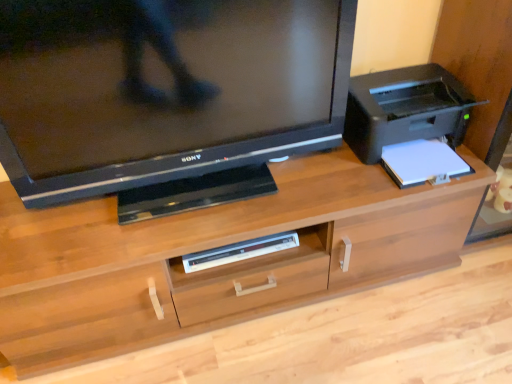
Where is `matte black television at upper left`? matte black television at upper left is located at coordinates (164, 89).

Describe the element at coordinates (164, 89) in the screenshot. This screenshot has width=512, height=384. I see `matte black television at upper left` at that location.

At what (x,y) coordinates should I click in order to perform the action: click on wooden desk at center. Please return your answer as a coordinate pair (x, y). The image size is (512, 384). Looking at the image, I should click on (217, 267).

Would you consider wooden desk at center to be distant from matte black television at upper left?

wooden desk at center is near matte black television at upper left, not far away.

From the image's perspective, which object appears higher, wooden desk at center or matte black television at upper left?

matte black television at upper left.

You are a GUI agent. You are given a task and a screenshot of the screen. Output one action in this format:
    pyautogui.click(x=<x>, y=<y>)
    Task: Click on the desk below the matte black television at upper left (from the image's perspective)
    
    Given the screenshot: What is the action you would take?
    pyautogui.click(x=217, y=267)

Is matte black television at upper left touching white plastic dvd player at center?

matte black television at upper left is not next to white plastic dvd player at center, and they're not touching.

Is matte black television at upper left outside of white plastic dvd player at center?

matte black television at upper left lies outside white plastic dvd player at center's area.

From a real-world perspective, which is physically above, matte black television at upper left or white plastic dvd player at center?

From a 3D spatial view, matte black television at upper left is above.

You are a GUI agent. You are given a task and a screenshot of the screen. Output one action in this format:
    pyautogui.click(x=<x>, y=<y>)
    Task: Click on the equipment lying behind the matte black television at upper left
    This screenshot has width=512, height=384.
    Given the screenshot: What is the action you would take?
    pyautogui.click(x=239, y=251)

Between wooden desk at center and white plastic dvd player at center, which one has larger width?

With larger width is wooden desk at center.

What's the angular difference between wooden desk at center and white plastic dvd player at center's facing directions?

The facing directions of wooden desk at center and white plastic dvd player at center are 3.06 degrees apart.

Is point (383, 217) more distant than point (275, 236)?

No, it is in front of (275, 236).

Based on the photo, is wooden desk at center inside the boundaries of white plastic dvd player at center, or outside?

wooden desk at center is located beyond the bounds of white plastic dvd player at center.

From a real-world perspective, is matte black television at upper left physically located above or below wooden desk at center?

In terms of real-world spatial position, matte black television at upper left is above wooden desk at center.

Is matte black television at upper left positioned far away from wooden desk at center?

matte black television at upper left is near wooden desk at center, not far away.

Is wooden desk at center at the back of matte black television at upper left?

No, wooden desk at center is not at the back of matte black television at upper left.

Measure the distance from matte black television at upper left to wooden desk at center.

matte black television at upper left and wooden desk at center are 11.96 inches apart.

Is white plastic dvd player at center positioned with its back to matte black television at upper left?

white plastic dvd player at center is not turned away from matte black television at upper left.

Considering the relative sizes of white plastic dvd player at center and matte black television at upper left in the image provided, is white plastic dvd player at center taller than matte black television at upper left?

Incorrect, the height of white plastic dvd player at center is not larger of that of matte black television at upper left.

Can you confirm if white plastic dvd player at center is bigger than matte black television at upper left?

No, white plastic dvd player at center is not bigger than matte black television at upper left.

Is white plastic dvd player at center spatially inside matte black television at upper left, or outside of it?

white plastic dvd player at center is not inside matte black television at upper left, it's outside.

Is white plastic dvd player at center not close to wooden desk at center?

No.

From a real-world perspective, is white plastic dvd player at center beneath wooden desk at center?

Actually, white plastic dvd player at center is physically above wooden desk at center in the real world.

Which is further, (268, 243) or (351, 242)?

Positioned behind is point (268, 243).

From the image's perspective, would you say white plastic dvd player at center is shown under wooden desk at center?

Indeed, from the image's perspective, white plastic dvd player at center is shown beneath wooden desk at center.

In order to click on television in front of the wooden desk at center in this screenshot , I will do [164, 89].

Locate an element on the screen. The height and width of the screenshot is (384, 512). equipment behind the matte black television at upper left is located at coordinates (239, 251).

In the scene shown: Looking at the image, which one is located closer to white plastic dvd player at center, matte black television at upper left or wooden desk at center?

wooden desk at center.

Based on the photo, when comparing their distances from wooden desk at center, does white plastic dvd player at center or matte black television at upper left seem closer?

white plastic dvd player at center lies closer to wooden desk at center than the other object.

Based on the photo, considering their positions, is matte black television at upper left positioned closer to wooden desk at center than white plastic dvd player at center?

white plastic dvd player at center is closer to wooden desk at center.

Based on their spatial positions, is white plastic dvd player at center or wooden desk at center closer to matte black television at upper left?

Among the two, wooden desk at center is located nearer to matte black television at upper left.

Estimate the real-world distances between objects in this image. Which object is closer to matte black television at upper left, wooden desk at center or white plastic dvd player at center?

wooden desk at center is closer to matte black television at upper left.

Looking at the image, which one is located closer to white plastic dvd player at center, wooden desk at center or matte black television at upper left?

wooden desk at center is positioned closer to the anchor white plastic dvd player at center.

Locate an element on the screen. desk between matte black television at upper left and white plastic dvd player at center in the front-back direction is located at coordinates click(x=217, y=267).